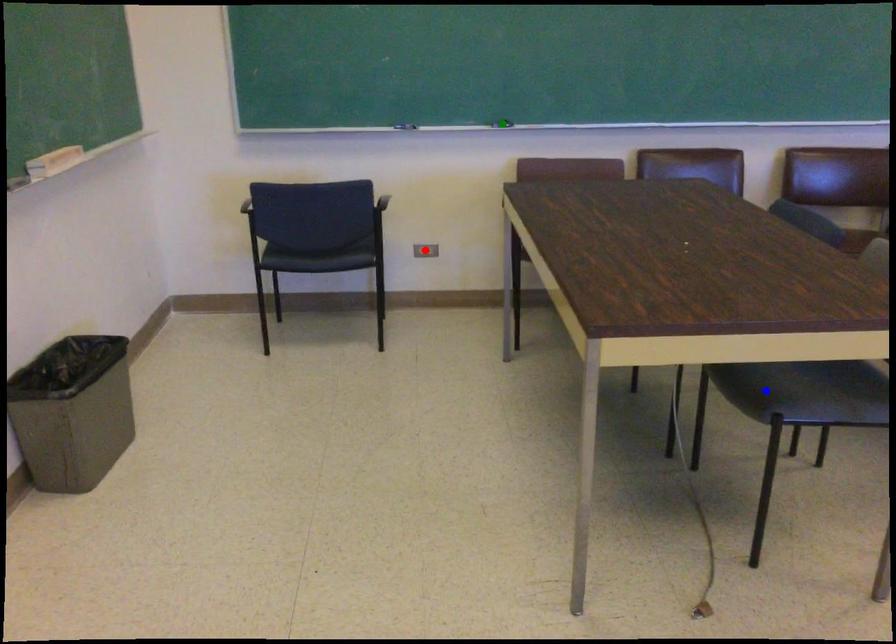
Order these from nearest to farthest:
1. green point
2. blue point
3. red point

blue point → green point → red point